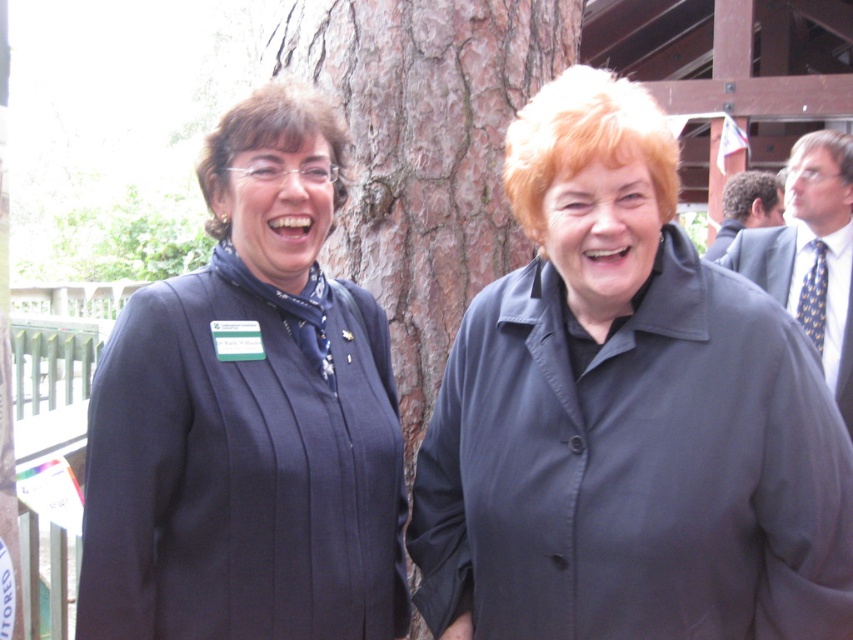
Who is shorter, brown rough bark at center or polka dot tie at right?

With less height is polka dot tie at right.

Find the location of a particular element. Image resolution: width=853 pixels, height=640 pixels. brown rough bark at center is located at coordinates (425, 154).

Identify the location of brown rough bark at center. (425, 154).

Image resolution: width=853 pixels, height=640 pixels. What are the coordinates of `brown rough bark at center` in the screenshot? It's located at (425, 154).

Does matte black blazer at left have a greater width compared to polka dot tie at right?

Indeed, matte black blazer at left has a greater width compared to polka dot tie at right.

Can you confirm if matte black blazer at left is positioned to the left of polka dot tie at right?

Yes, matte black blazer at left is to the left of polka dot tie at right.

Does point (334, 196) lie in front of point (746, 250)?

Yes, it is.

Locate an element on the screen. matte black blazer at left is located at coordinates (248, 417).

Can you confirm if matte black blazer at left is taller than dark blue suit at right?

Indeed, matte black blazer at left has a greater height compared to dark blue suit at right.

Is point (117, 602) farther from camera compared to point (737, 182)?

That is False.

What do you see at coordinates (248, 417) in the screenshot? I see `matte black blazer at left` at bounding box center [248, 417].

Identify the location of matte black blazer at left. (x=248, y=417).